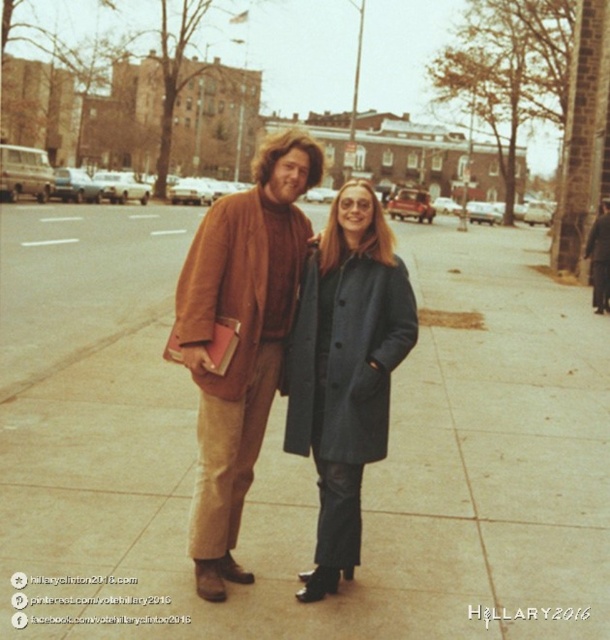
In the scene shown: You are standing on the slate gray concrete sidewalk at center and want to reach the matte brown jacket at center. Which direction should you move to get closer to the jacket?

The slate gray concrete sidewalk at center is closer to the viewer than the matte brown jacket at center, so to reach the jacket, you should move backward away from the sidewalk towards the jacket.

You are a delivery person standing on the sidewalk and need to place a package between the slate gray concrete sidewalk at center and the dark gray wool coat at center. Which object should you place it closer to?

You should place the package closer to the dark gray wool coat at center because the slate gray concrete sidewalk at center is to the left of the dark gray wool coat at center, meaning the sidewalk is further away from the coat. Therefore, placing the package near the coat would be between them.

What is the 2D coordinate of the slate gray concrete sidewalk at center?

The 2D coordinate of the slate gray concrete sidewalk at center is at point (296, 456).